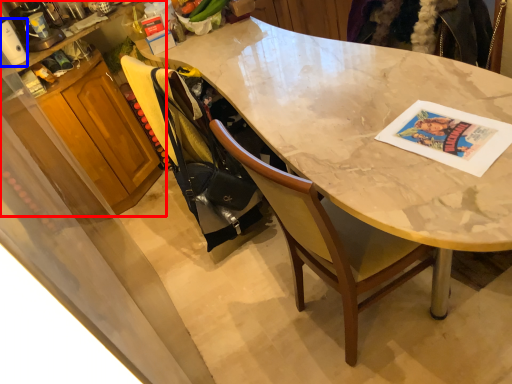
Question: Which object appears closest to the camera in this image, cabinetry (highlighted by a red box) or appliance (highlighted by a blue box)?

Choices:
 (A) cabinetry
 (B) appliance

Answer: (B)